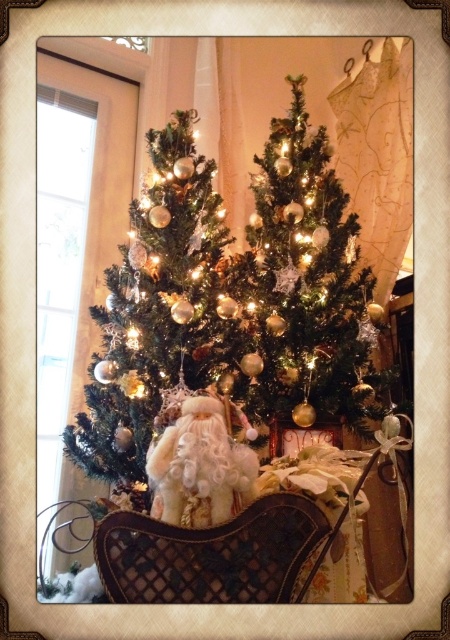
Question: Which is nearer to the shiny gold ornaments at left?

Choices:
 (A) white fluffy santa at center
 (B) shiny gold ornaments at center

Answer: (A)

Question: Considering the relative positions of shiny gold ornaments at left and shiny gold ornaments at center in the image provided, where is shiny gold ornaments at left located with respect to shiny gold ornaments at center?

Choices:
 (A) right
 (B) left

Answer: (B)

Question: Is shiny gold ornaments at left above shiny gold ornaments at center?

Choices:
 (A) no
 (B) yes

Answer: (A)

Question: Observing the image, what is the correct spatial positioning of shiny gold ornaments at left in reference to shiny gold ornaments at center?

Choices:
 (A) below
 (B) above

Answer: (A)

Question: Which object is farther from the camera taking this photo?

Choices:
 (A) white fluffy santa at center
 (B) shiny gold ornaments at center
 (C) shiny gold ornaments at left

Answer: (B)

Question: Which is farther from the white fluffy santa at center?

Choices:
 (A) shiny gold ornaments at center
 (B) shiny gold ornaments at left

Answer: (A)